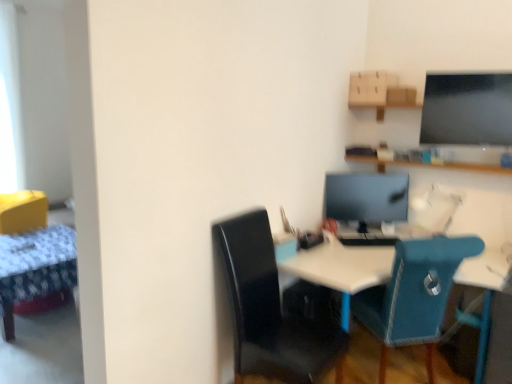
Image resolution: width=512 pixels, height=384 pixels. What do you see at coordinates (269, 310) in the screenshot? I see `black leather chair at center, which is the second chair from right to left` at bounding box center [269, 310].

At what (x,y) coordinates should I click in order to perform the action: click on white plastic desk at center. Please return your answer as a coordinate pair (x, y). Looking at the image, I should click on (342, 266).

Is wooden table at left smaller than black leather chair at center, which is the second chair from right to left?

Incorrect, wooden table at left is not smaller in size than black leather chair at center, which is the second chair from right to left.

Is wooden table at left thinner than black leather chair at center, which is the first chair in left-to-right order?

Incorrect, the width of wooden table at left is not less than that of black leather chair at center, which is the first chair in left-to-right order.

Considering the sizes of objects wooden table at left and black leather chair at center, which is the second chair from right to left, in the image provided, who is taller, wooden table at left or black leather chair at center, which is the second chair from right to left,?

Standing taller between the two is black leather chair at center, which is the second chair from right to left.

Based on the photo, which is more to the right, matte black monitor at center or black leather chair at center, which is the second chair from right to left?

matte black monitor at center is more to the right.

Who is bigger, matte black monitor at center or black leather chair at center, which is the first chair in left-to-right order?

black leather chair at center, which is the first chair in left-to-right order, is bigger.

Does point (376, 220) come in front of point (247, 332)?

No, (376, 220) is further to viewer.

From a real-world perspective, is white plastic desk at center physically above black leather chair at center, which is the second chair from right to left?

No, from a real-world perspective, white plastic desk at center is not on top of black leather chair at center, which is the second chair from right to left.

Considering their positions, is white plastic desk at center located in front of or behind black leather chair at center, which is the second chair from right to left?

white plastic desk at center is positioned farther from the viewer than black leather chair at center, which is the second chair from right to left.

Considering the relative sizes of white plastic desk at center and black leather chair at center, which is the second chair from right to left, in the image provided, is white plastic desk at center smaller than black leather chair at center, which is the second chair from right to left,?

No.

Considering the relative sizes of black leather chair at center, which is the first chair in left-to-right order, and white plastic desk at center in the image provided, is black leather chair at center, which is the first chair in left-to-right order, wider than white plastic desk at center?

No, black leather chair at center, which is the first chair in left-to-right order, is not wider than white plastic desk at center.

Considering the relative positions of black leather chair at center, which is the second chair from right to left, and white plastic desk at center in the image provided, is black leather chair at center, which is the second chair from right to left, to the left or to the right of white plastic desk at center?

black leather chair at center, which is the second chair from right to left, is positioned on white plastic desk at center's left side.

Which of these two, black leather chair at center, which is the first chair in left-to-right order, or white plastic desk at center, is bigger?

With larger size is white plastic desk at center.

From the image's perspective, is matte black monitor at center above or below teal fabric chair at center, acting as the second chair starting from the left?

From the image's perspective, matte black monitor at center appears above teal fabric chair at center, acting as the second chair starting from the left.

Is matte black monitor at center thinner than teal fabric chair at center, acting as the second chair starting from the left?

Yes, matte black monitor at center is thinner than teal fabric chair at center, acting as the second chair starting from the left.

Is matte black monitor at center facing away from teal fabric chair at center, acting as the second chair starting from the left?

No, teal fabric chair at center, acting as the second chair starting from the left, is not at the back of matte black monitor at center.

How many degrees apart are the facing directions of matte black monitor at center and teal fabric chair at center, acting as the second chair starting from the left?

175 degrees separate the facing orientations of matte black monitor at center and teal fabric chair at center, acting as the second chair starting from the left.

Considering the sizes of objects black leather chair at center, which is the first chair in left-to-right order, and wooden table at left in the image provided, who is wider, black leather chair at center, which is the first chair in left-to-right order, or wooden table at left?

wooden table at left.

Would you say black leather chair at center, which is the first chair in left-to-right order, is inside or outside wooden table at left?

The correct answer is: outside.

Who is bigger, black leather chair at center, which is the second chair from right to left, or wooden table at left?

wooden table at left is bigger.

Who is taller, black leather chair at center, which is the second chair from right to left, or wooden table at left?

With more height is black leather chair at center, which is the second chair from right to left.

Looking at this image, is teal fabric chair at center, which is the first chair from right to left, wider or thinner than white plastic desk at center?

In the image, teal fabric chair at center, which is the first chair from right to left, appears to be more narrow than white plastic desk at center.

Measure the distance from teal fabric chair at center, which is the first chair from right to left, to white plastic desk at center.

teal fabric chair at center, which is the first chair from right to left, is 11.24 inches away from white plastic desk at center.

From the image's perspective, is teal fabric chair at center, acting as the second chair starting from the left, located above or below white plastic desk at center?

teal fabric chair at center, acting as the second chair starting from the left, is above white plastic desk at center.

Is point (428, 376) closer to camera compared to point (377, 254)?

Yes, it is.

Identify the location of table that is on the left side of black leather chair at center, which is the first chair in left-to-right order. This screenshot has height=384, width=512. (35, 267).

You are a GUI agent. You are given a task and a screenshot of the screen. Output one action in this format:
    pyautogui.click(x=<x>, y=<y>)
    Task: Click on the computer monitor above the black leather chair at center, which is the first chair in left-to-right order (from a real-world perspective)
    
    Given the screenshot: What is the action you would take?
    point(366,197)

Considering their positions, is wooden table at left positioned closer to teal fabric chair at center, which is the first chair from right to left, than matte black monitor at center?

matte black monitor at center lies closer to teal fabric chair at center, which is the first chair from right to left, than the other object.

When comparing their distances from wooden table at left, does matte black monitor at center or black leather chair at center, which is the second chair from right to left, seem closer?

black leather chair at center, which is the second chair from right to left.

When comparing their distances from teal fabric chair at center, which is the first chair from right to left, does matte black monitor at center or wooden table at left seem further?

wooden table at left is further to teal fabric chair at center, which is the first chair from right to left.

Based on their spatial positions, is teal fabric chair at center, which is the first chair from right to left, or black leather chair at center, which is the second chair from right to left, further from white plastic desk at center?

black leather chair at center, which is the second chair from right to left, is positioned further to the anchor white plastic desk at center.

From the image, which object appears to be farther from white plastic desk at center, wooden table at left or matte black monitor at center?

wooden table at left.

Estimate the real-world distances between objects in this image. Which object is closer to teal fabric chair at center, acting as the second chair starting from the left, black leather chair at center, which is the first chair in left-to-right order, or matte black monitor at center?

The object closer to teal fabric chair at center, acting as the second chair starting from the left, is black leather chair at center, which is the first chair in left-to-right order.

Based on their spatial positions, is wooden table at left or black leather chair at center, which is the second chair from right to left, closer to white plastic desk at center?

black leather chair at center, which is the second chair from right to left, is closer to white plastic desk at center.

Estimate the real-world distances between objects in this image. Which object is closer to black leather chair at center, which is the first chair in left-to-right order, teal fabric chair at center, acting as the second chair starting from the left, or white plastic desk at center?

white plastic desk at center.

Locate an element on the screen. chair between black leather chair at center, which is the first chair in left-to-right order, and matte black monitor at center in the front-back direction is located at coordinates (414, 294).

The height and width of the screenshot is (384, 512). I want to click on chair situated between wooden table at left and white plastic desk at center from left to right, so click(269, 310).

I want to click on chair between wooden table at left and teal fabric chair at center, acting as the second chair starting from the left, in the horizontal direction, so click(269, 310).

Identify the location of desk located between black leather chair at center, which is the second chair from right to left, and teal fabric chair at center, which is the first chair from right to left, in the left-right direction. Image resolution: width=512 pixels, height=384 pixels. (342, 266).